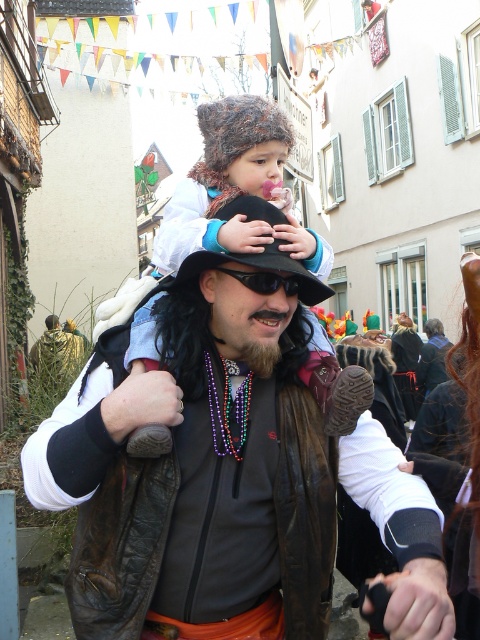
You are a photographer trying to capture the man and child in the center of the scene. You notice the fluffy brown hat at center and the black plastic goggles at center. Which object should you focus on first if you want to capture the leftmost item in your frame?

The fluffy brown hat at center is to the left of black plastic goggles at center, so you should focus on the fluffy brown hat at center first to capture the leftmost item.

You are a photographer trying to capture a candid shot of the man and child in the lively street scene. You notice the fluffy brown hat at center and the black felt hat at center. To ensure both hats are in focus, what is the minimum distance you should set your camera lens to focus on?

The minimum focus distance should be set to at least 13.24 inches to ensure both the fluffy brown hat at center and the black felt hat at center are in focus.

You are a photographer trying to capture the perfect shot of the two hats in the scene. You want to arrange them in a way that the fluffy brown hat at center is on the right side of the black felt hat at center. Is this possible based on their current positions?

The fluffy brown hat at center is currently to the left of the black felt hat at center. To have the fluffy brown hat at center on the right side of the black felt hat at center, you would need to adjust their positions, which isn not possible with their current arrangement.